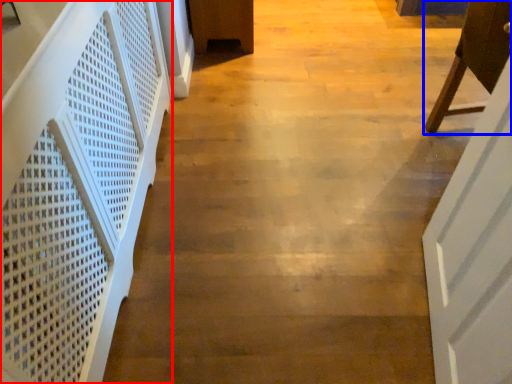
Question: Which object appears closest to the camera in this image, stairwell (highlighted by a red box) or furniture (highlighted by a blue box)?

Choices:
 (A) stairwell
 (B) furniture

Answer: (A)